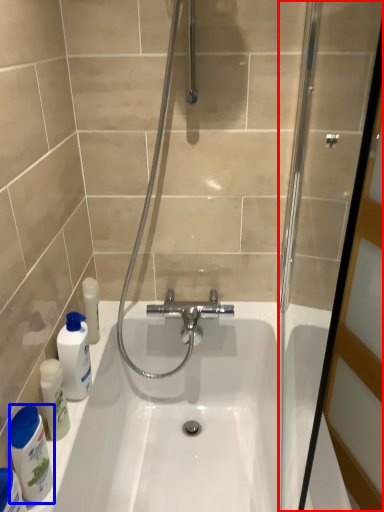
Question: Which object is closer to the camera taking this photo, screen door (highlighted by a red box) or cleaning product (highlighted by a blue box)?

Choices:
 (A) screen door
 (B) cleaning product

Answer: (A)